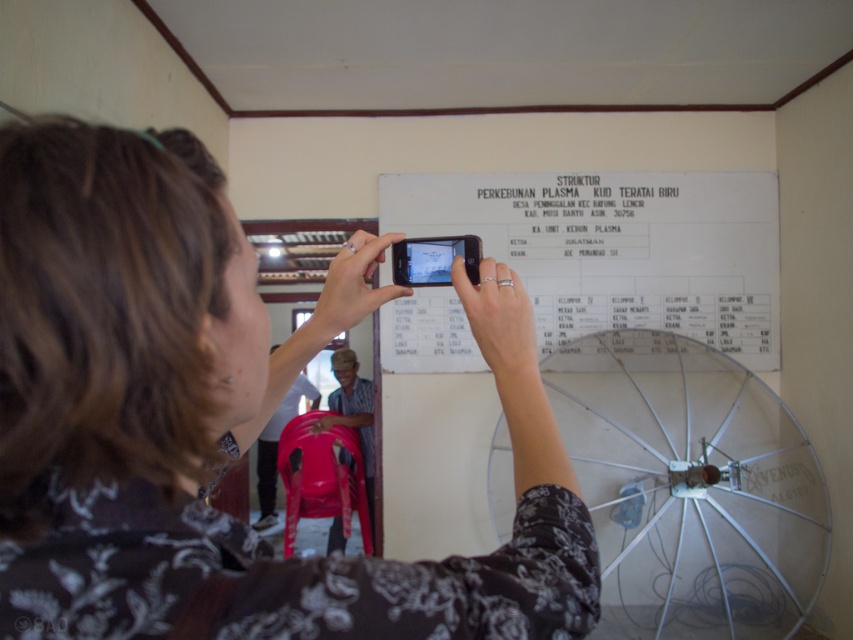
Question: Based on their relative distances, which object is farther from the floral-patterned shirt at center?

Choices:
 (A) white paper at upper center
 (B) metallic silver umbrella at center

Answer: (A)

Question: Can you confirm if floral-patterned shirt at center is smaller than metallic silver umbrella at center?

Choices:
 (A) no
 (B) yes

Answer: (B)

Question: Can you confirm if floral-patterned shirt at center is positioned to the right of white paper at upper center?

Choices:
 (A) no
 (B) yes

Answer: (A)

Question: In this image, where is metallic silver umbrella at center located relative to white paper at upper center?

Choices:
 (A) below
 (B) above

Answer: (A)

Question: Among these objects, which one is farthest from the camera?

Choices:
 (A) metallic silver umbrella at center
 (B) floral-patterned shirt at center

Answer: (A)

Question: Which is nearer to the metallic silver umbrella at center?

Choices:
 (A) white paper at upper center
 (B) floral-patterned shirt at center

Answer: (A)